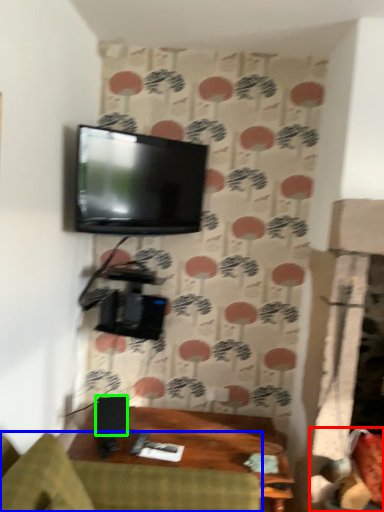
Question: Based on their relative distances, which object is nearer to swivel chair (highlighted by a red box)? Choose from studio couch (highlighted by a blue box) and speaker (highlighted by a green box).

Choices:
 (A) studio couch
 (B) speaker

Answer: (A)